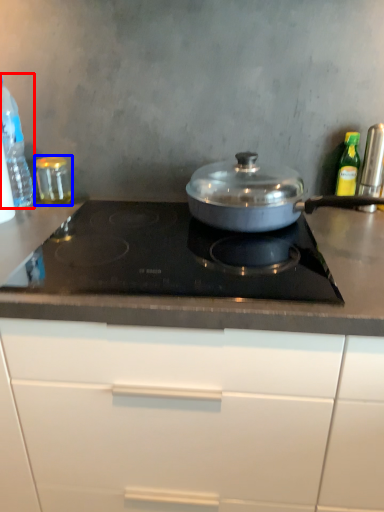
Question: Which object is further to the camera taking this photo, kitchen appliance (highlighted by a red box) or kitchen appliance (highlighted by a blue box)?

Choices:
 (A) kitchen appliance
 (B) kitchen appliance

Answer: (B)